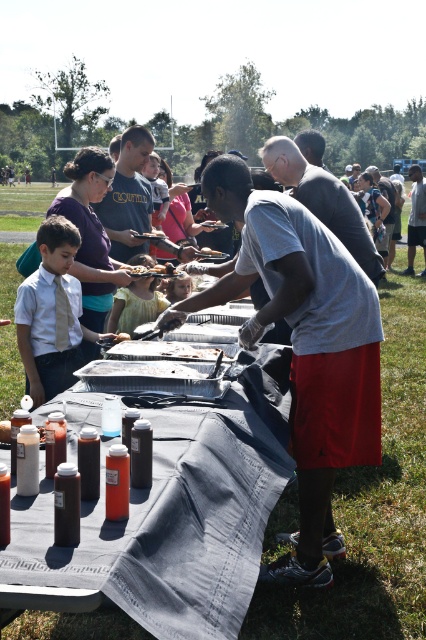
Question: Which of the following is the farthest from the observer?

Choices:
 (A) white styrofoam tray at center
 (B) black plastic table at center

Answer: (A)

Question: Does white styrofoam tray at center come in front of brown paper bag at center?

Choices:
 (A) no
 (B) yes

Answer: (B)

Question: Observing the image, what is the correct spatial positioning of yellow fabric dress at center in reference to brown paper bag at center?

Choices:
 (A) above
 (B) below

Answer: (B)

Question: Can you confirm if matte white shirt at center is positioned to the left of yellow fabric dress at center?

Choices:
 (A) yes
 (B) no

Answer: (A)

Question: Which object appears closest to the camera in this image?

Choices:
 (A) matte white shirt at center
 (B) black plastic table at center
 (C) yellow fabric dress at center

Answer: (B)

Question: Which of the following is the closest to the observer?

Choices:
 (A) (178, 374)
 (B) (58, 580)
 (C) (186, 355)
 (D) (215, 252)

Answer: (B)